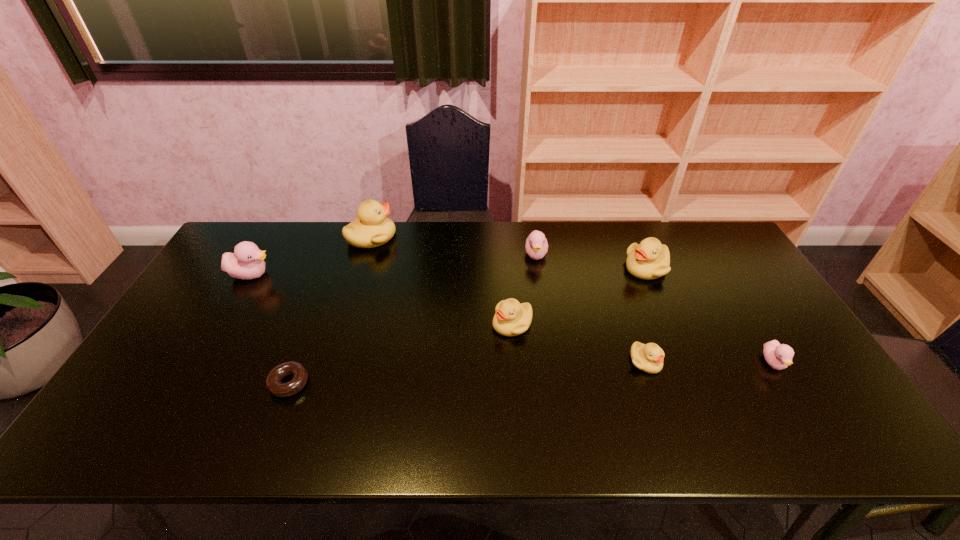
The width and height of the screenshot is (960, 540). I want to click on the rightmost object, so click(x=779, y=356).

Find the location of a particular element. The image size is (960, 540). the nearest yellow duckling is located at coordinates (649, 358).

Identify the location of brown doughnut. The image size is (960, 540). (273, 381).

Locate an element on the screen. doughnut is located at coordinates (273, 381).

Identify the location of free location located 0.120m on the front-facing side of the leftmost yellow duckling. (430, 237).

This screenshot has width=960, height=540. Identify the location of vacant space located on the front-facing side of the biggest pink duckling. (389, 274).

Find the location of `free space located on the front-facing side of the third nearest yellow duckling`. free space located on the front-facing side of the third nearest yellow duckling is located at coordinates (575, 268).

This screenshot has width=960, height=540. Find the location of `free spot located 0.340m on the front-facing side of the third nearest yellow duckling`. free spot located 0.340m on the front-facing side of the third nearest yellow duckling is located at coordinates [x=519, y=268].

Where is `free space located 0.400m on the front-facing side of the third nearest yellow duckling`? The width and height of the screenshot is (960, 540). free space located 0.400m on the front-facing side of the third nearest yellow duckling is located at coordinates (501, 268).

This screenshot has height=540, width=960. Identify the location of vacant space located 0.340m on the front-facing side of the second smallest pink duckling. (550, 349).